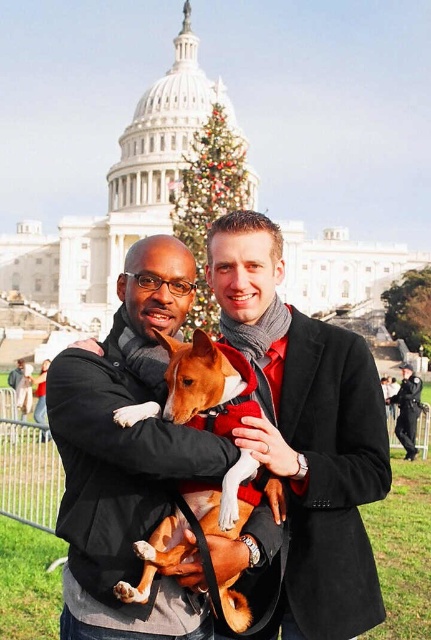
Question: Where is matte black jacket at center located in relation to green textured christmas tree at center in the image?

Choices:
 (A) above
 (B) below

Answer: (B)

Question: In this image, where is brown furry dog at center located relative to green textured christmas tree at center?

Choices:
 (A) below
 (B) above

Answer: (A)

Question: Among these objects, which one is farthest from the camera?

Choices:
 (A) dark blue uniform at center
 (B) green textured christmas tree at center

Answer: (B)

Question: Estimate the real-world distances between objects in this image. Which object is farther from the dark blue uniform at center?

Choices:
 (A) brown furry dog at center
 (B) matte black jacket at center

Answer: (B)

Question: Which object is farther from the camera taking this photo?

Choices:
 (A) dark blue uniform at center
 (B) green textured christmas tree at center

Answer: (B)

Question: Is green textured christmas tree at center below dark blue uniform at center?

Choices:
 (A) no
 (B) yes

Answer: (A)